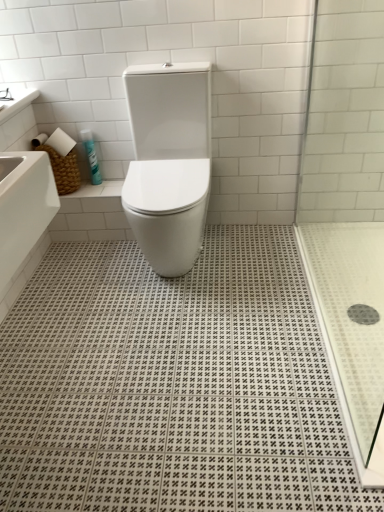
Question: Can you confirm if black rubber drain at lower right is bigger than transparent glass shower door at right?

Choices:
 (A) yes
 (B) no

Answer: (B)

Question: Is black rubber drain at lower right next to transparent glass shower door at right and touching it?

Choices:
 (A) no
 (B) yes

Answer: (A)

Question: Does black rubber drain at lower right have a greater height compared to transparent glass shower door at right?

Choices:
 (A) yes
 (B) no

Answer: (B)

Question: From a real-world perspective, is black rubber drain at lower right on transparent glass shower door at right?

Choices:
 (A) no
 (B) yes

Answer: (A)

Question: Can you confirm if black rubber drain at lower right is positioned to the right of transparent glass shower door at right?

Choices:
 (A) yes
 (B) no

Answer: (A)

Question: Is black rubber drain at lower right outside transparent glass shower door at right?

Choices:
 (A) no
 (B) yes

Answer: (B)

Question: Is white glossy countertop at upper left closer to camera compared to black rubber drain at lower right?

Choices:
 (A) no
 (B) yes

Answer: (A)

Question: Is white glossy countertop at upper left completely or partially outside of black rubber drain at lower right?

Choices:
 (A) yes
 (B) no

Answer: (A)

Question: Would you say white glossy countertop at upper left contains black rubber drain at lower right?

Choices:
 (A) yes
 (B) no

Answer: (B)

Question: From a real-world perspective, is white glossy countertop at upper left over black rubber drain at lower right?

Choices:
 (A) yes
 (B) no

Answer: (A)

Question: Can you confirm if white glossy countertop at upper left is thinner than black rubber drain at lower right?

Choices:
 (A) yes
 (B) no

Answer: (B)

Question: Is white glossy countertop at upper left looking in the opposite direction of black rubber drain at lower right?

Choices:
 (A) no
 (B) yes

Answer: (A)

Question: Considering the relative positions of white glossy countertop at upper left and blue glossy spray can at upper left in the image provided, is white glossy countertop at upper left to the right of blue glossy spray can at upper left from the viewer's perspective?

Choices:
 (A) no
 (B) yes

Answer: (A)